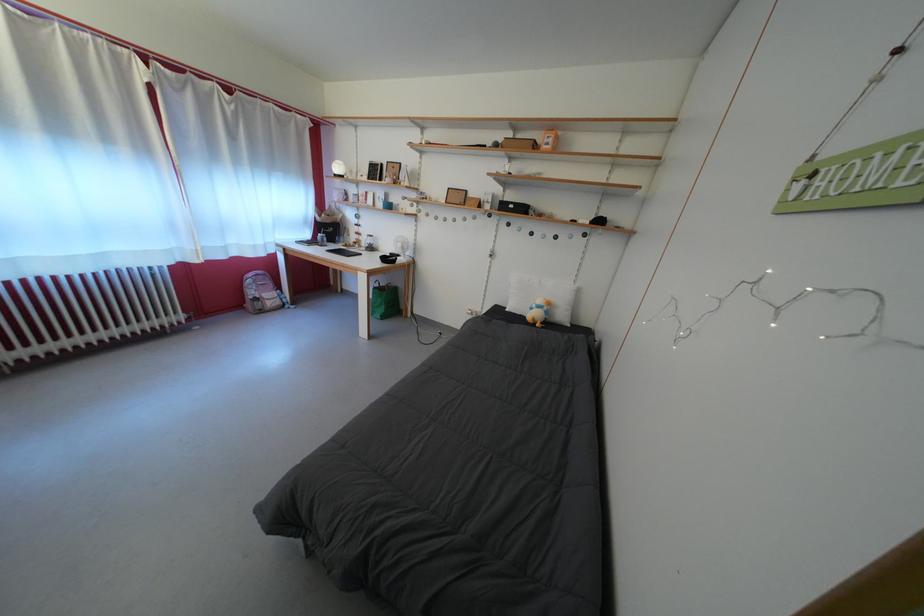
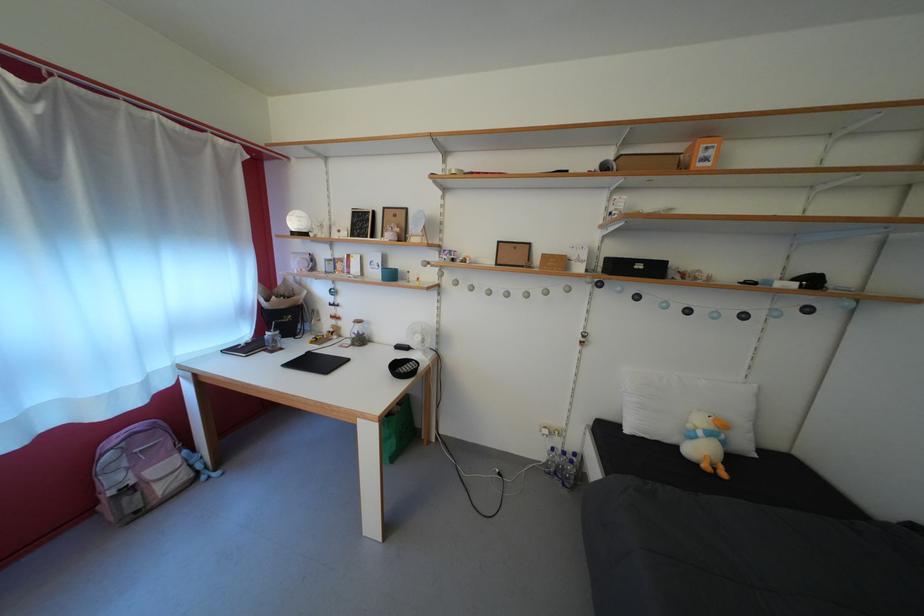
The images are taken continuously from a first-person perspective. In which direction are you moving?

The cameraman moved toward left, forward.